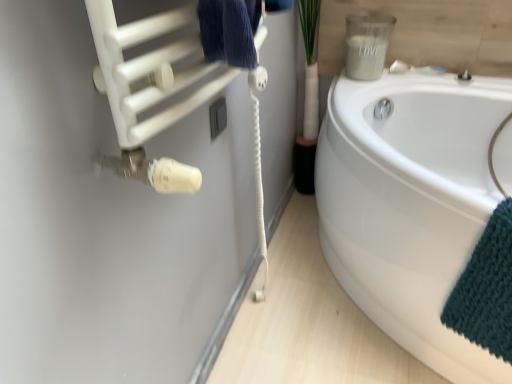
Describe the element at coordinates (486, 289) in the screenshot. The height and width of the screenshot is (384, 512). I see `teal knitted towel at lower right` at that location.

Find the location of a particular element. This screenshot has width=512, height=384. white matte towel at upper left is located at coordinates (106, 219).

Locate an element on the screen. The width and height of the screenshot is (512, 384). white glossy bathtub at lower right is located at coordinates (410, 204).

Image resolution: width=512 pixels, height=384 pixels. Identify the location of satin nickel faucet at upper right. (464, 76).

Is teal knitted towel at lower right taller or shorter than white glossy bathtub at lower right?

Clearly, teal knitted towel at lower right is shorter compared to white glossy bathtub at lower right.

From a real-world perspective, which is physically below, teal knitted towel at lower right or white glossy bathtub at lower right?

From a 3D spatial view, white glossy bathtub at lower right is below.

Where is `bath towel that appears below the white glossy bathtub at lower right (from the image's perspective)`? bath towel that appears below the white glossy bathtub at lower right (from the image's perspective) is located at coordinates (486, 289).

Which of these two, white matte towel at upper left or satin nickel faucet at upper right, stands taller?

Standing taller between the two is white matte towel at upper left.

Is white matte towel at upper left not inside satin nickel faucet at upper right?

white matte towel at upper left is positioned outside satin nickel faucet at upper right.

At what (x,y) coordinates should I click in order to perform the action: click on wool below the satin nickel faucet at upper right (from the image's perspective). Please return your answer as a coordinate pair (x, y). This screenshot has width=512, height=384. Looking at the image, I should click on (106, 219).

From a real-world perspective, which is physically below, white matte towel at upper left or satin nickel faucet at upper right?

From a 3D spatial view, white matte towel at upper left is below.

From a real-world perspective, which object stands above the other?

satin nickel faucet at upper right is physically above.

Is satin nickel faucet at upper right shorter than white matte towel at upper left?

Yes, satin nickel faucet at upper right is shorter than white matte towel at upper left.

Is satin nickel faucet at upper right next to white matte towel at upper left?

No, satin nickel faucet at upper right is not next to white matte towel at upper left.

What's the angular difference between teal knitted towel at lower right and white matte towel at upper left's facing directions?

The angular difference between teal knitted towel at lower right and white matte towel at upper left is 115 degrees.

Is teal knitted towel at lower right further to camera compared to white matte towel at upper left?

Yes, teal knitted towel at lower right is behind white matte towel at upper left.

Which object is positioned more to the left, teal knitted towel at lower right or white matte towel at upper left?

Positioned to the left is white matte towel at upper left.

I want to click on bath towel located on the right of white matte towel at upper left, so click(486, 289).

Does satin nickel faucet at upper right have a lesser width compared to white glossy bathtub at lower right?

Yes, satin nickel faucet at upper right is thinner than white glossy bathtub at lower right.

Is satin nickel faucet at upper right turned away from white glossy bathtub at lower right?

Yes, satin nickel faucet at upper right is facing away from white glossy bathtub at lower right.

Does point (463, 81) lie behind point (369, 211)?

Yes.

Considering the relative positions of satin nickel faucet at upper right and white glossy bathtub at lower right in the image provided, is satin nickel faucet at upper right in front of white glossy bathtub at lower right?

No.

Consider the image. From the image's perspective, between white matte towel at upper left and teal knitted towel at lower right, which one is located above?

From the image's view, white matte towel at upper left is above.

From their relative heights in the image, would you say white matte towel at upper left is taller or shorter than teal knitted towel at lower right?

white matte towel at upper left is taller than teal knitted towel at lower right.

Considering the sizes of white matte towel at upper left and teal knitted towel at lower right in the image, is white matte towel at upper left bigger or smaller than teal knitted towel at lower right?

Considering their sizes, white matte towel at upper left takes up more space than teal knitted towel at lower right.

Which is in front, point (46, 359) or point (457, 285)?

The point (46, 359) is closer to the camera.

What's the angular difference between teal knitted towel at lower right and satin nickel faucet at upper right's facing directions?

The facing directions of teal knitted towel at lower right and satin nickel faucet at upper right are 25.6 degrees apart.

Which of these two, teal knitted towel at lower right or satin nickel faucet at upper right, stands shorter?

Standing shorter between the two is satin nickel faucet at upper right.

From the image's perspective, relative to satin nickel faucet at upper right, is teal knitted towel at lower right above or below?

Clearly, from the image's perspective, teal knitted towel at lower right is below satin nickel faucet at upper right.

This screenshot has height=384, width=512. Identify the location of faucet behind the teal knitted towel at lower right. (464, 76).

Where is `bathtub in front of the teal knitted towel at lower right`? This screenshot has width=512, height=384. bathtub in front of the teal knitted towel at lower right is located at coordinates (410, 204).

At what (x,y) coordinates should I click in order to perform the action: click on wool that is on the left side of satin nickel faucet at upper right. Please return your answer as a coordinate pair (x, y). Looking at the image, I should click on (106, 219).

Considering their positions, is satin nickel faucet at upper right positioned closer to white matte towel at upper left than teal knitted towel at lower right?

Based on the image, teal knitted towel at lower right appears to be nearer to white matte towel at upper left.

From the image, which object appears to be nearer to teal knitted towel at lower right, white matte towel at upper left or white glossy bathtub at lower right?

white glossy bathtub at lower right is positioned closer to the anchor teal knitted towel at lower right.

When comparing their distances from white matte towel at upper left, does white glossy bathtub at lower right or teal knitted towel at lower right seem closer?

The object closer to white matte towel at upper left is white glossy bathtub at lower right.

Which object lies further to the anchor point teal knitted towel at lower right, white glossy bathtub at lower right or satin nickel faucet at upper right?

Based on the image, satin nickel faucet at upper right appears to be further to teal knitted towel at lower right.

When comparing their distances from satin nickel faucet at upper right, does white matte towel at upper left or teal knitted towel at lower right seem further?

Among the two, white matte towel at upper left is located further to satin nickel faucet at upper right.

Which object lies further to the anchor point white matte towel at upper left, teal knitted towel at lower right or satin nickel faucet at upper right?

satin nickel faucet at upper right lies further to white matte towel at upper left than the other object.

Which object lies further to the anchor point white glossy bathtub at lower right, teal knitted towel at lower right or white matte towel at upper left?

white matte towel at upper left is further to white glossy bathtub at lower right.

Which object lies nearer to the anchor point teal knitted towel at lower right, satin nickel faucet at upper right or white matte towel at upper left?

white matte towel at upper left is closer to teal knitted towel at lower right.

Locate an element on the screen. Image resolution: width=512 pixels, height=384 pixels. bathtub between white matte towel at upper left and teal knitted towel at lower right from left to right is located at coordinates (410, 204).

Where is `bathtub between white matte towel at upper left and satin nickel faucet at upper right in the front-back direction`? This screenshot has height=384, width=512. bathtub between white matte towel at upper left and satin nickel faucet at upper right in the front-back direction is located at coordinates (410, 204).

You are a GUI agent. You are given a task and a screenshot of the screen. Output one action in this format:
    pyautogui.click(x=<x>, y=<y>)
    Task: Click on the bath towel positioned between white matte towel at upper left and satin nickel faucet at upper right from near to far
    The image size is (512, 384).
    Given the screenshot: What is the action you would take?
    click(486, 289)

Where is `bath towel between white glossy bathtub at lower right and satin nickel faucet at upper right from front to back`? bath towel between white glossy bathtub at lower right and satin nickel faucet at upper right from front to back is located at coordinates (486, 289).